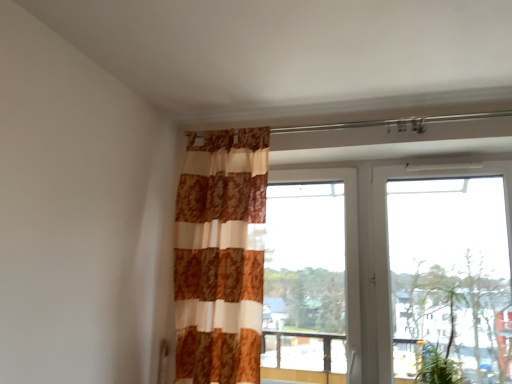
Question: Are green leafy plant at lower right and white plastic window at upper right, the 2th window when ordered from left to right, far apart?

Choices:
 (A) yes
 (B) no

Answer: (B)

Question: Is green leafy plant at lower right positioned beyond the bounds of white plastic window at upper right, the 1th window viewed from the right?

Choices:
 (A) yes
 (B) no

Answer: (B)

Question: From a real-world perspective, is green leafy plant at lower right located higher than white plastic window at upper right, the 2th window when ordered from left to right?

Choices:
 (A) no
 (B) yes

Answer: (A)

Question: Can you confirm if green leafy plant at lower right is positioned to the right of white plastic window at upper right, the 2th window when ordered from left to right?

Choices:
 (A) yes
 (B) no

Answer: (B)

Question: Is green leafy plant at lower right positioned behind white plastic window at upper right, the 2th window when ordered from left to right?

Choices:
 (A) yes
 (B) no

Answer: (A)

Question: Is white plastic window at upper right, the 1th window viewed from the right, bigger or smaller than patterned fabric curtain at center?

Choices:
 (A) big
 (B) small

Answer: (A)

Question: From the image's perspective, relative to patterned fabric curtain at center, is white plastic window at upper right, the 1th window viewed from the right, above or below?

Choices:
 (A) below
 (B) above

Answer: (A)

Question: Is white plastic window at upper right, the 2th window when ordered from left to right, inside the boundaries of patterned fabric curtain at center, or outside?

Choices:
 (A) outside
 (B) inside

Answer: (A)

Question: In terms of width, does white plastic window at upper right, the 2th window when ordered from left to right, look wider or thinner when compared to patterned fabric curtain at center?

Choices:
 (A) wide
 (B) thin

Answer: (B)

Question: In terms of height, does green leafy plant at lower right look taller or shorter compared to white plastic window at upper right, the 1th window viewed from the right?

Choices:
 (A) short
 (B) tall

Answer: (A)

Question: From the image's perspective, relative to white plastic window at upper right, the 1th window viewed from the right, is green leafy plant at lower right above or below?

Choices:
 (A) below
 (B) above

Answer: (A)

Question: Is point (426, 281) closer or farther from the camera than point (276, 175)?

Choices:
 (A) closer
 (B) farther

Answer: (A)

Question: In the image, is green leafy plant at lower right on the left side or the right side of white plastic window at upper right, the 2th window when ordered from left to right?

Choices:
 (A) left
 (B) right

Answer: (A)

Question: Considering the positions of white plastic window at upper right, the 1th window viewed from the right, and transparent glass window at center, acting as the 2th window starting from the right, in the image, is white plastic window at upper right, the 1th window viewed from the right, bigger or smaller than transparent glass window at center, acting as the 2th window starting from the right,?

Choices:
 (A) big
 (B) small

Answer: (A)

Question: Would you say white plastic window at upper right, the 1th window viewed from the right, is to the left or to the right of transparent glass window at center, acting as the 2th window starting from the right, in the picture?

Choices:
 (A) left
 (B) right

Answer: (B)